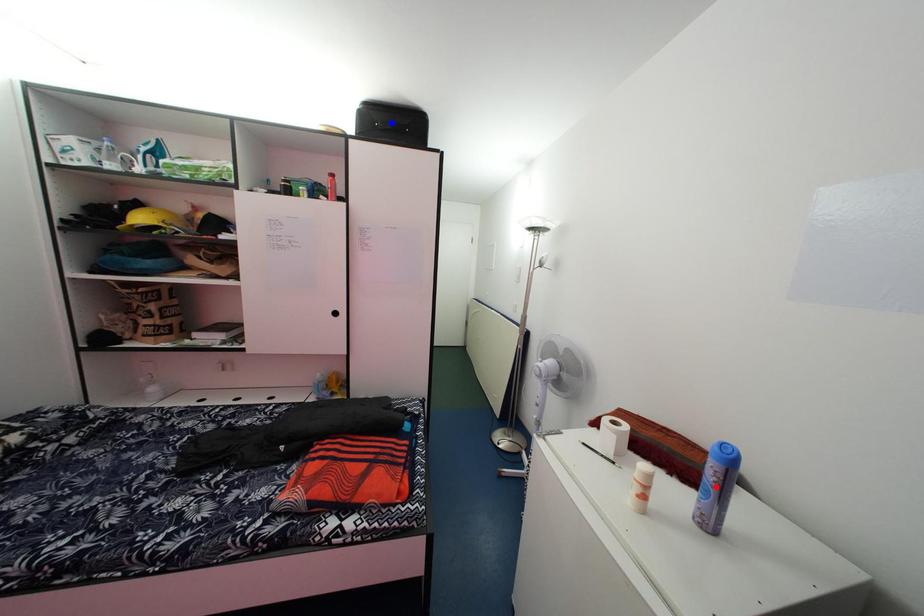
Question: Which of the two points in the image is closer to the camera?

Choices:
 (A) Blue point is closer.
 (B) Red point is closer.

Answer: (B)